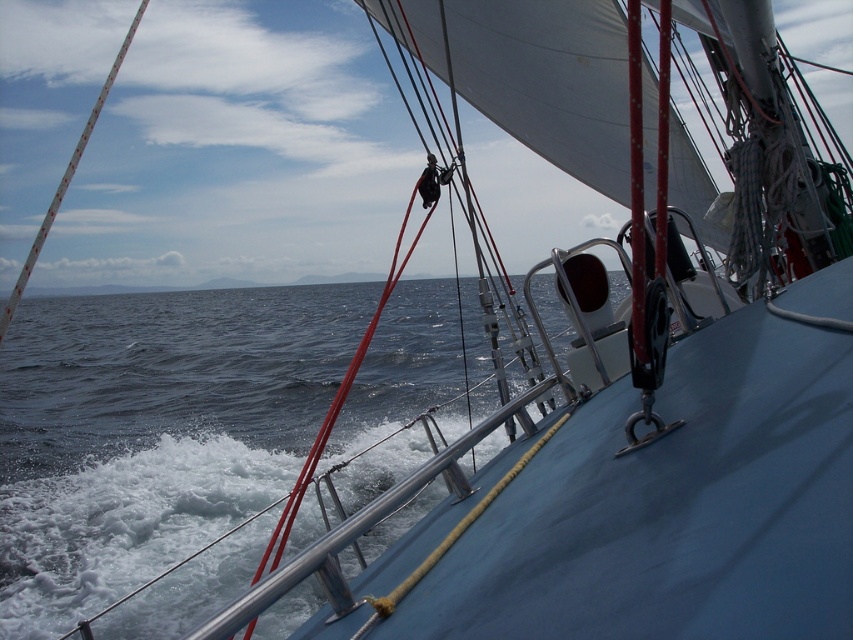
You are standing on the deck of the sailing vessel and want to retrieve a floating item that is near the blue water at lower left. If your maximum reach without bending or leaning is 3 meters, can you safely reach the item from your current position?

The blue water at lower left is 3.97 meters away from the viewer. Since your maximum reach is 3 meters, you cannot safely reach the item without bending or leaning.

You are a sailor standing on the deck of the ship. You notice the blue water at lower left and the white textured pole at upper left. Which object appears wider from your current viewpoint?

The blue water at lower left appears wider than the white textured pole at upper left because its width is larger according to the description.

You are standing on the deck of the boat and notice the blue water at lower left and the white textured pole at upper left. Which object is closer to the horizon?

The white textured pole at upper left is closer to the horizon because it has a greater height than the blue water at lower left.